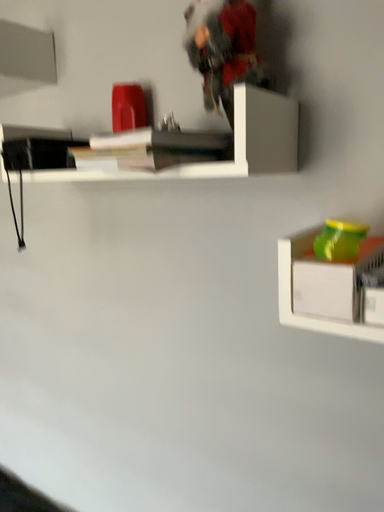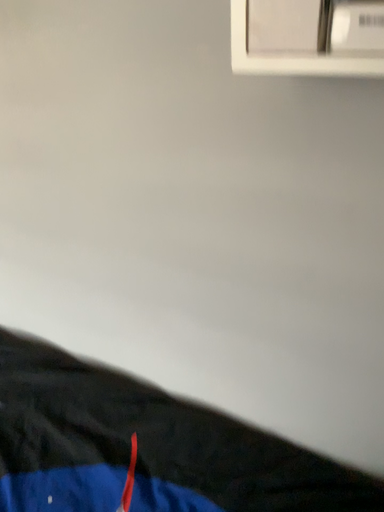
Question: Which way did the camera rotate in the video?

Choices:
 (A) rotated left
 (B) rotated right

Answer: (B)